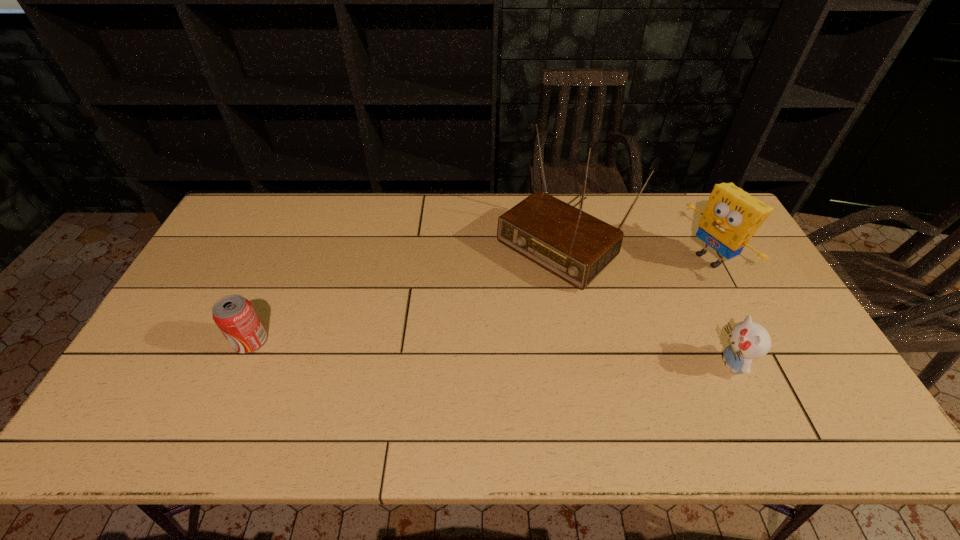
Image resolution: width=960 pixels, height=540 pixels. I want to click on free space on the desktop that is between the leftmost object and the kitten and is positioned on the front panel of the radio_receiver, so click(423, 349).

Locate an element on the screen. Image resolution: width=960 pixels, height=540 pixels. vacant space on the desktop that is between the leftmost object and the kitten and is positioned on the face of the sponge is located at coordinates (510, 353).